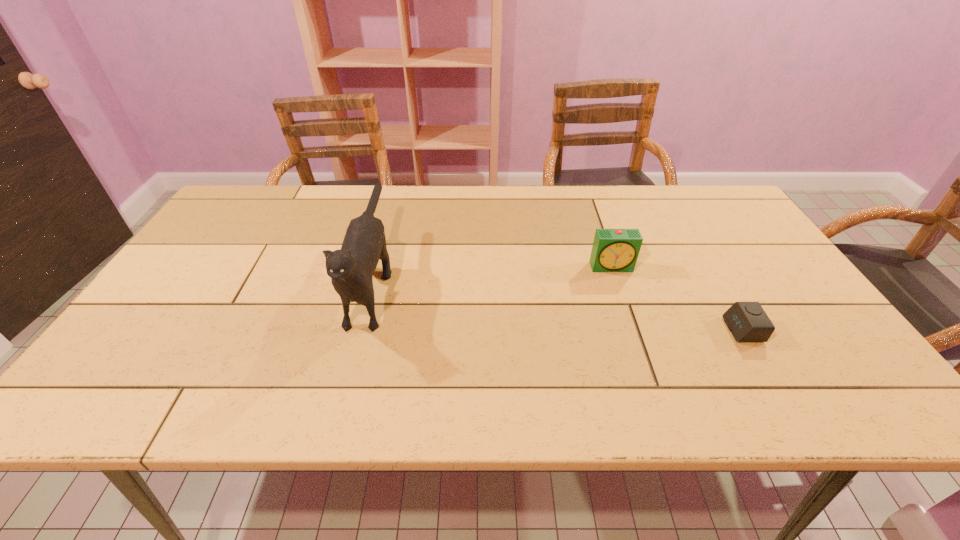
Locate an element on the screen. The image size is (960, 540). free space located 0.280m on the front-facing side of the shorter alarm clock is located at coordinates (609, 330).

Find the location of `free region at the far edge of the desktop`. free region at the far edge of the desktop is located at coordinates (468, 200).

At what (x,y) coordinates should I click in order to perform the action: click on free spot at the near edge of the desktop. Please return your answer as a coordinate pair (x, y). Looking at the image, I should click on (208, 411).

This screenshot has width=960, height=540. I want to click on blank space at the left edge, so click(162, 332).

In the image, there is a desktop. Where is `free region at the right edge`? This screenshot has height=540, width=960. free region at the right edge is located at coordinates (705, 228).

The height and width of the screenshot is (540, 960). In the image, there is a desktop. In order to click on blank space at the far left corner in this screenshot , I will do `click(272, 195)`.

The height and width of the screenshot is (540, 960). What are the coordinates of `vacant space at the far right corner of the desktop` in the screenshot? It's located at (683, 196).

Locate an element on the screen. free space that is in between the right alarm clock and the second object from right to left is located at coordinates (678, 298).

Locate an element on the screen. The height and width of the screenshot is (540, 960). free space between the taller alarm clock and the tallest object is located at coordinates (492, 273).

This screenshot has width=960, height=540. I want to click on vacant space that is in between the farther alarm clock and the shorter alarm clock, so click(678, 298).